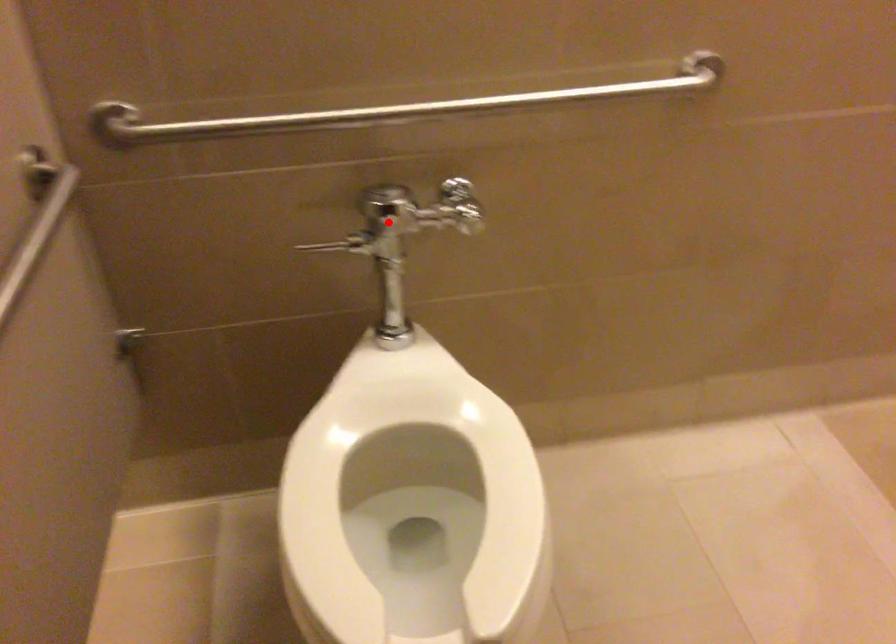
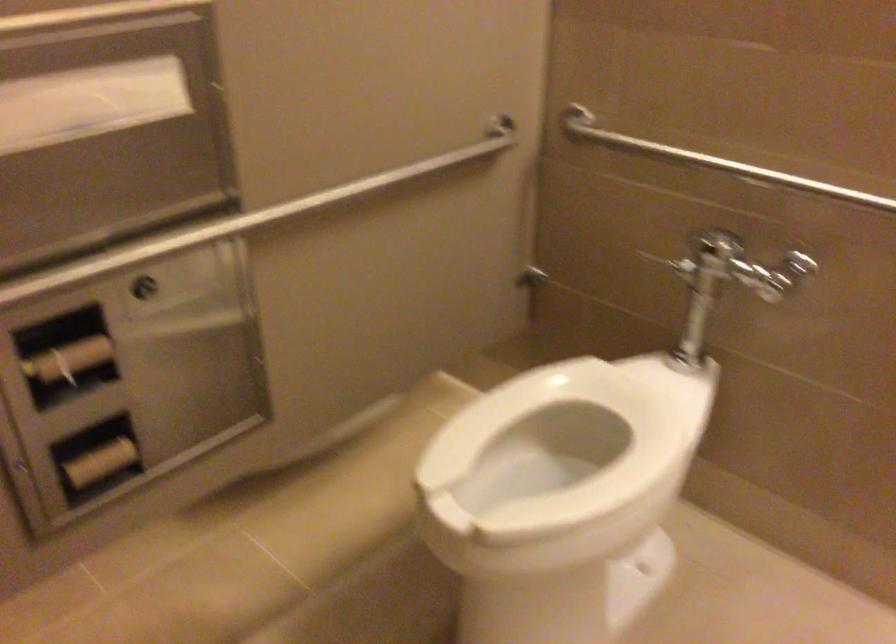
The point at the highlighted location is marked in the first image. Where is the corresponding point in the second image?

(703, 260)